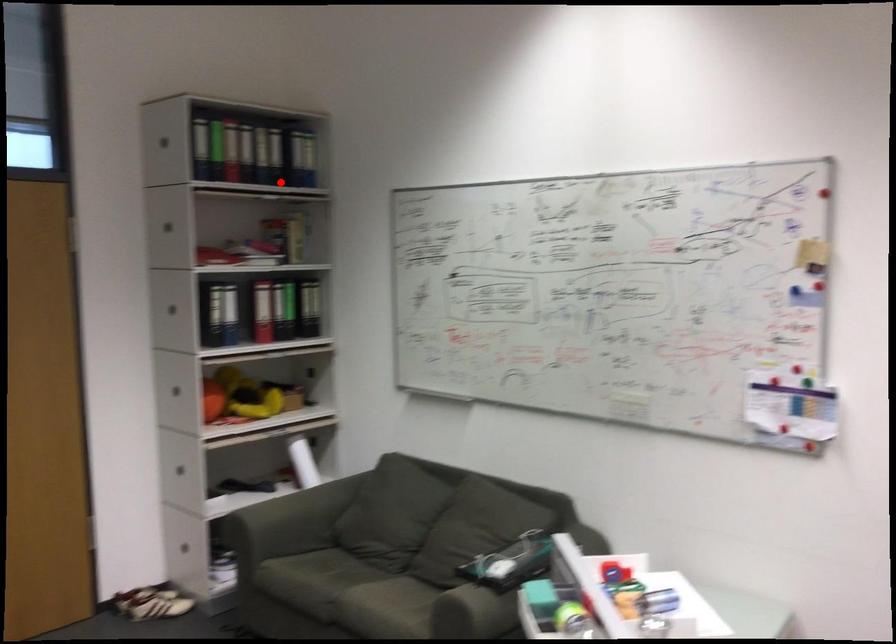
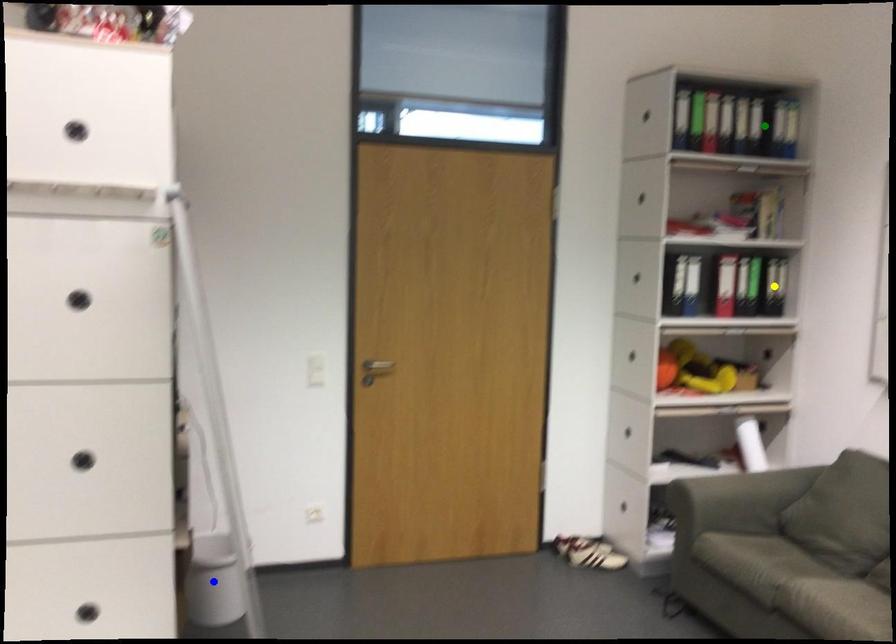
Question: I am providing you with two images of the same scene from different viewpoints. A red point is marked on the first image. You are given multiple points on the second image. Which point in image 2 represents the same 3d spot as the red point in image 1?

Choices:
 (A) green point
 (B) yellow point
 (C) blue point

Answer: (A)